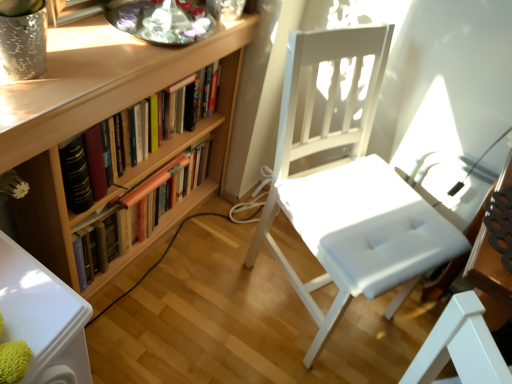
Where is `wooden bookcase at left`? This screenshot has height=384, width=512. wooden bookcase at left is located at coordinates (102, 119).

Locate an element on the screen. This screenshot has width=512, height=384. white leather chair at center is located at coordinates (348, 191).

Where is `wooden bookcase at left`? wooden bookcase at left is located at coordinates (102, 119).

Who is bigger, wooden bookshelf at left, the second book ordered from the bottom, or wooden bookshelf at left, marked as the second book in a top-to-bottom arrangement?

Bigger between the two is wooden bookshelf at left, marked as the second book in a top-to-bottom arrangement.

Could you tell me if wooden bookshelf at left, the second book ordered from the bottom, is turned towards wooden bookshelf at left, the 1th book positioned from the bottom?

No, wooden bookshelf at left, the second book ordered from the bottom, is not aimed at wooden bookshelf at left, the 1th book positioned from the bottom.

This screenshot has width=512, height=384. There is a wooden bookshelf at left, marked as the second book in a top-to-bottom arrangement. What are the coordinates of `book above it (from a real-world perspective)` in the screenshot? It's located at pyautogui.click(x=134, y=136).

Is wooden bookshelf at left, the second book ordered from the bottom, located outside wooden bookcase at left?

No, wooden bookshelf at left, the second book ordered from the bottom, is inside wooden bookcase at left's boundary.

Is wooden bookshelf at left, the first book positioned from the top, behind wooden bookcase at left?

Yes.

Considering the relative sizes of wooden bookshelf at left, the first book positioned from the top, and wooden bookcase at left in the image provided, is wooden bookshelf at left, the first book positioned from the top, smaller than wooden bookcase at left?

Yes, wooden bookshelf at left, the first book positioned from the top, is smaller than wooden bookcase at left.

How many degrees apart are the facing directions of wooden bookshelf at left, the second book ordered from the bottom, and wooden bookcase at left?

The angle between the facing direction of wooden bookshelf at left, the second book ordered from the bottom, and the facing direction of wooden bookcase at left is 0.000108 degrees.

Considering the sizes of wooden bookshelf at left, the first book positioned from the top, and white leather chair at center in the image, is wooden bookshelf at left, the first book positioned from the top, wider or thinner than white leather chair at center?

Considering their sizes, wooden bookshelf at left, the first book positioned from the top, looks slimmer than white leather chair at center.

From a real-world perspective, which object rests below the other?

white leather chair at center.

Is wooden bookshelf at left, the first book positioned from the top, taller or shorter than white leather chair at center?

wooden bookshelf at left, the first book positioned from the top, is shorter than white leather chair at center.

Find the location of a particular element. The image size is (512, 384). book that is above the wooden bookcase at left (from the image's perspective) is located at coordinates (134, 136).

Based on the photo, from the image's perspective, is wooden bookcase at left positioned above or below wooden bookshelf at left, the second book ordered from the bottom?

From the image's perspective, wooden bookcase at left appears below wooden bookshelf at left, the second book ordered from the bottom.

Which is in front, point (79, 219) or point (71, 151)?

The point (71, 151) is more forward.

Choose the correct answer: Is white leather chair at center inside wooden bookcase at left or outside it?

The correct answer is: outside.

From a real-world perspective, who is located lower, white leather chair at center or wooden bookcase at left?

In real-world perspective, wooden bookcase at left is lower.

Is white leather chair at center at the left side of wooden bookcase at left?

No.

Between wooden bookcase at left and white leather chair at center, which one has less height?

wooden bookcase at left.

From the picture: Is there a large distance between wooden bookcase at left and white leather chair at center?

No, wooden bookcase at left is not far from white leather chair at center.

Considering the sizes of objects wooden bookcase at left and white leather chair at center in the image provided, who is smaller, wooden bookcase at left or white leather chair at center?

Smaller between the two is white leather chair at center.

Which is in front, wooden bookshelf at left, the 1th book positioned from the bottom, or wooden bookcase at left?

wooden bookcase at left.

Is wooden bookshelf at left, marked as the second book in a top-to-bottom arrangement, next to wooden bookcase at left?

No, wooden bookshelf at left, marked as the second book in a top-to-bottom arrangement, is not beside wooden bookcase at left.

In the scene shown: Which object is positioned more to the left, wooden bookshelf at left, the 1th book positioned from the bottom, or wooden bookcase at left?

wooden bookshelf at left, the 1th book positioned from the bottom, is more to the left.

Find the location of a particular element. The width and height of the screenshot is (512, 384). bookcase positioned vertically above the wooden bookshelf at left, marked as the second book in a top-to-bottom arrangement (from a real-world perspective) is located at coordinates (102, 119).

Locate an element on the screen. book above the wooden bookshelf at left, marked as the second book in a top-to-bottom arrangement (from the image's perspective) is located at coordinates (134, 136).

Image resolution: width=512 pixels, height=384 pixels. In order to click on book on the right of wooden bookcase at left in this screenshot , I will do `click(134, 136)`.

Consider the image. From the image, which object appears to be farther from wooden bookcase at left, wooden bookshelf at left, the 1th book positioned from the bottom, or wooden bookshelf at left, the first book positioned from the top?

wooden bookshelf at left, the 1th book positioned from the bottom, is further to wooden bookcase at left.

Looking at the image, which one is located closer to wooden bookcase at left, wooden bookshelf at left, the first book positioned from the top, or wooden bookshelf at left, the 1th book positioned from the bottom?

wooden bookshelf at left, the first book positioned from the top, lies closer to wooden bookcase at left than the other object.

Consider the image. Looking at the image, which one is located closer to white leather chair at center, wooden bookcase at left or wooden bookshelf at left, the 1th book positioned from the bottom?

wooden bookcase at left.

Based on their spatial positions, is white leather chair at center or wooden bookshelf at left, the first book positioned from the top, further from wooden bookcase at left?

white leather chair at center.

Which object lies further to the anchor point white leather chair at center, wooden bookshelf at left, the 1th book positioned from the bottom, or wooden bookshelf at left, the first book positioned from the top?

wooden bookshelf at left, the 1th book positioned from the bottom.

When comparing their distances from wooden bookshelf at left, the first book positioned from the top, does white leather chair at center or wooden bookshelf at left, the 1th book positioned from the bottom, seem closer?

The object closer to wooden bookshelf at left, the first book positioned from the top, is wooden bookshelf at left, the 1th book positioned from the bottom.

From the image, which object appears to be farther from wooden bookshelf at left, the first book positioned from the top, wooden bookcase at left or white leather chair at center?

white leather chair at center lies further to wooden bookshelf at left, the first book positioned from the top, than the other object.

From the image, which object appears to be nearer to wooden bookshelf at left, the second book ordered from the bottom, wooden bookshelf at left, marked as the second book in a top-to-bottom arrangement, or wooden bookcase at left?

Among the two, wooden bookcase at left is located nearer to wooden bookshelf at left, the second book ordered from the bottom.

Locate an element on the screen. bookcase situated between wooden bookshelf at left, marked as the second book in a top-to-bottom arrangement, and white leather chair at center from left to right is located at coordinates (102, 119).

Image resolution: width=512 pixels, height=384 pixels. I want to click on book situated between wooden bookcase at left and white leather chair at center from left to right, so click(134, 136).

You are a GUI agent. You are given a task and a screenshot of the screen. Output one action in this format:
    pyautogui.click(x=<x>, y=<y>)
    Task: Click on the book between wooden bookshelf at left, the 1th book positioned from the bottom, and white leather chair at center from left to right
    This screenshot has height=384, width=512.
    Given the screenshot: What is the action you would take?
    pyautogui.click(x=134, y=136)

You are a GUI agent. You are given a task and a screenshot of the screen. Output one action in this format:
    pyautogui.click(x=<x>, y=<y>)
    Task: Click on the book located between wooden bookcase at left and wooden bookshelf at left, the 1th book positioned from the bottom, in the depth direction
    The height and width of the screenshot is (384, 512).
    Given the screenshot: What is the action you would take?
    pyautogui.click(x=134, y=136)